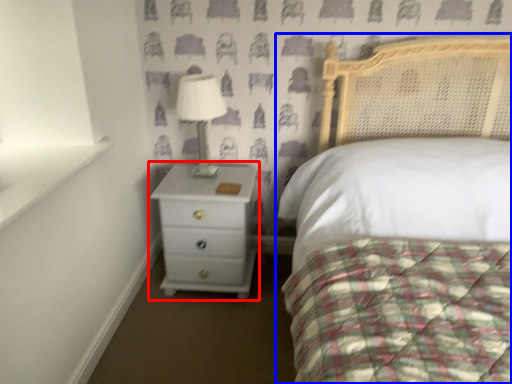
Question: Which of the following is the farthest to the observer, chest of drawers (highlighted by a red box) or bed (highlighted by a blue box)?

Choices:
 (A) chest of drawers
 (B) bed

Answer: (A)